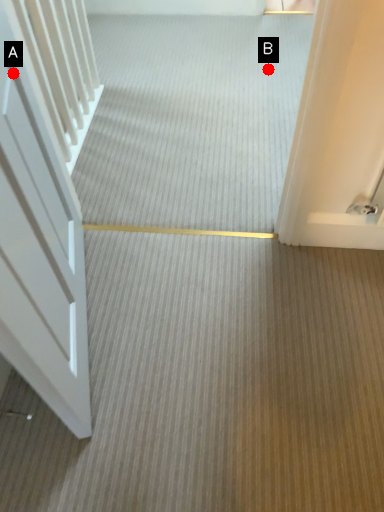
Question: Two points are circled on the image, labeled by A and B beside each circle. Which point appears closest to the camera in this image?

Choices:
 (A) A is closer
 (B) B is closer

Answer: (A)